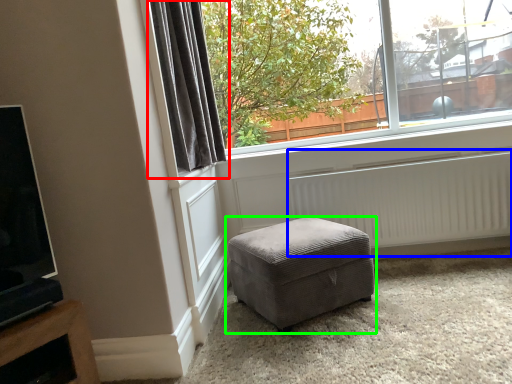
Question: Based on their relative distances, which object is nearer to curtain (highlighted by a red box)? Choose from radiator (highlighted by a blue box) and studio couch (highlighted by a green box).

Choices:
 (A) radiator
 (B) studio couch

Answer: (B)